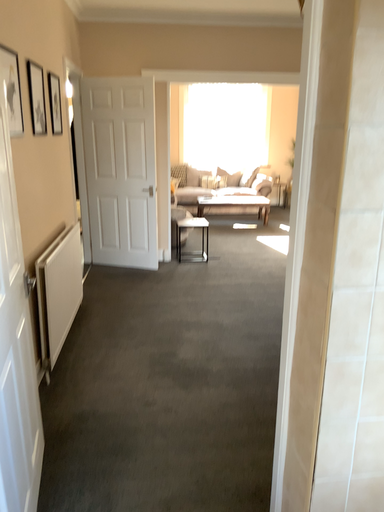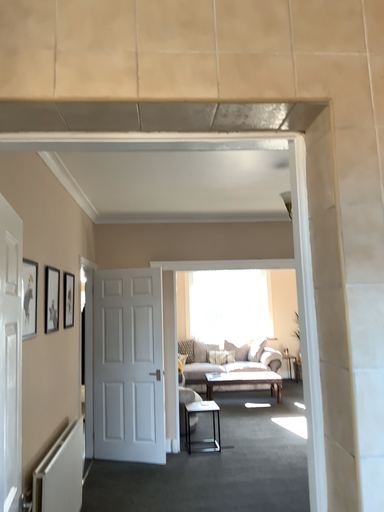
Question: How did the camera likely rotate when shooting the video?

Choices:
 (A) rotated downward
 (B) rotated upward

Answer: (B)